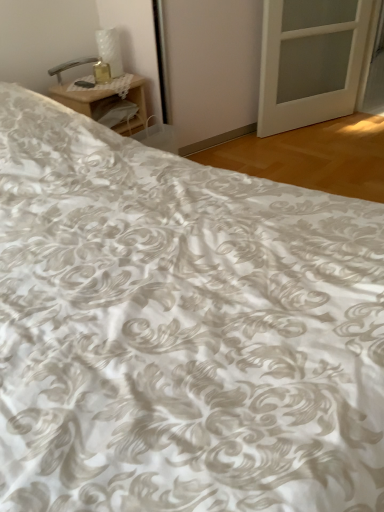
Question: Based on their positions, is woodennightstand at upper left located to the left or right of metallic silver table lamp at upper left?

Choices:
 (A) right
 (B) left

Answer: (A)

Question: Is woodennightstand at upper left wider or thinner than metallic silver table lamp at upper left?

Choices:
 (A) wide
 (B) thin

Answer: (A)

Question: Is woodennightstand at upper left in front of or behind metallic silver table lamp at upper left in the image?

Choices:
 (A) behind
 (B) front

Answer: (B)

Question: Considering the positions of metallic silver table lamp at upper left and woodennightstand at upper left in the image, is metallic silver table lamp at upper left bigger or smaller than woodennightstand at upper left?

Choices:
 (A) small
 (B) big

Answer: (A)

Question: From a real-world perspective, is metallic silver table lamp at upper left above or below woodennightstand at upper left?

Choices:
 (A) below
 (B) above

Answer: (B)

Question: From the image's perspective, relative to woodennightstand at upper left, is metallic silver table lamp at upper left above or below?

Choices:
 (A) below
 (B) above

Answer: (B)

Question: Is metallic silver table lamp at upper left situated inside woodennightstand at upper left or outside?

Choices:
 (A) inside
 (B) outside

Answer: (B)